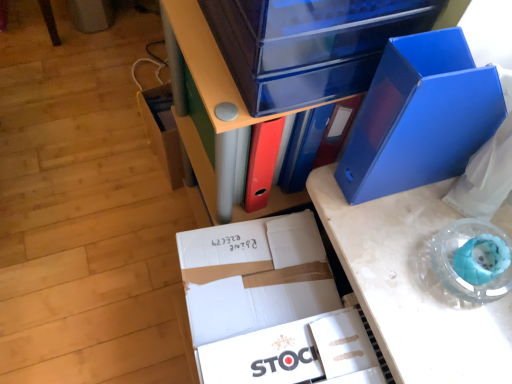
Question: Is blue plastic folder at upper right, positioned as the 2th paperback book in left-to-right order, looking in the opposite direction of blue plastic desk at center?

Choices:
 (A) no
 (B) yes

Answer: (A)

Question: From a real-world perspective, does blue plastic folder at upper right, the second paperback book ordered from the bottom, sit lower than blue plastic desk at center?

Choices:
 (A) no
 (B) yes

Answer: (A)

Question: From the image's perspective, would you say blue plastic folder at upper right, positioned as the 2th paperback book in left-to-right order, is positioned over blue plastic desk at center?

Choices:
 (A) no
 (B) yes

Answer: (B)

Question: Can you confirm if blue plastic folder at upper right, positioned as the first paperback book in right-to-left order, is taller than blue plastic desk at center?

Choices:
 (A) no
 (B) yes

Answer: (B)

Question: Does blue plastic folder at upper right, positioned as the 2th paperback book in left-to-right order, have a larger size compared to blue plastic desk at center?

Choices:
 (A) yes
 (B) no

Answer: (B)

Question: In terms of height, does blue plastic folder at upper right, arranged as the first paperback book when viewed from the top, look taller or shorter compared to transparent plastic storage box at upper center, which is the first storage box in front-to-back order?

Choices:
 (A) tall
 (B) short

Answer: (A)

Question: Is point (481, 125) positioned closer to the camera than point (262, 97)?

Choices:
 (A) farther
 (B) closer

Answer: (A)

Question: Looking at their shapes, would you say blue plastic folder at upper right, the second paperback book ordered from the bottom, is wider or thinner than transparent plastic storage box at upper center, arranged as the second storage box when viewed from the back?

Choices:
 (A) thin
 (B) wide

Answer: (A)

Question: From a real-world perspective, is blue plastic folder at upper right, positioned as the first paperback book in right-to-left order, above or below transparent plastic storage box at upper center, arranged as the second storage box when viewed from the left?

Choices:
 (A) above
 (B) below

Answer: (B)

Question: Is point (249, 230) closer or farther from the camera than point (279, 357)?

Choices:
 (A) farther
 (B) closer

Answer: (A)

Question: Would you say white cardboard box at center is to the left or to the right of white cardboard stock at center, the 1th paperback book from the bottom, in the picture?

Choices:
 (A) right
 (B) left

Answer: (B)

Question: From a real-world perspective, is white cardboard box at center above or below white cardboard stock at center, acting as the second paperback book starting from the right?

Choices:
 (A) below
 (B) above

Answer: (A)

Question: In the image, is white cardboard box at center positioned in front of or behind white cardboard stock at center, which is counted as the 2th paperback book, starting from the top?

Choices:
 (A) behind
 (B) front

Answer: (A)

Question: From the image's perspective, is transparent plastic storage box at upper center, arranged as the second storage box when viewed from the left, located above or below matte plastic storage box at lower left, which appears as the 1th storage box when viewed from the back?

Choices:
 (A) above
 (B) below

Answer: (A)

Question: Considering the positions of transparent plastic storage box at upper center, which is the first storage box in front-to-back order, and matte plastic storage box at lower left, the second storage box when ordered from right to left, in the image, is transparent plastic storage box at upper center, which is the first storage box in front-to-back order, wider or thinner than matte plastic storage box at lower left, the second storage box when ordered from right to left,?

Choices:
 (A) wide
 (B) thin

Answer: (A)